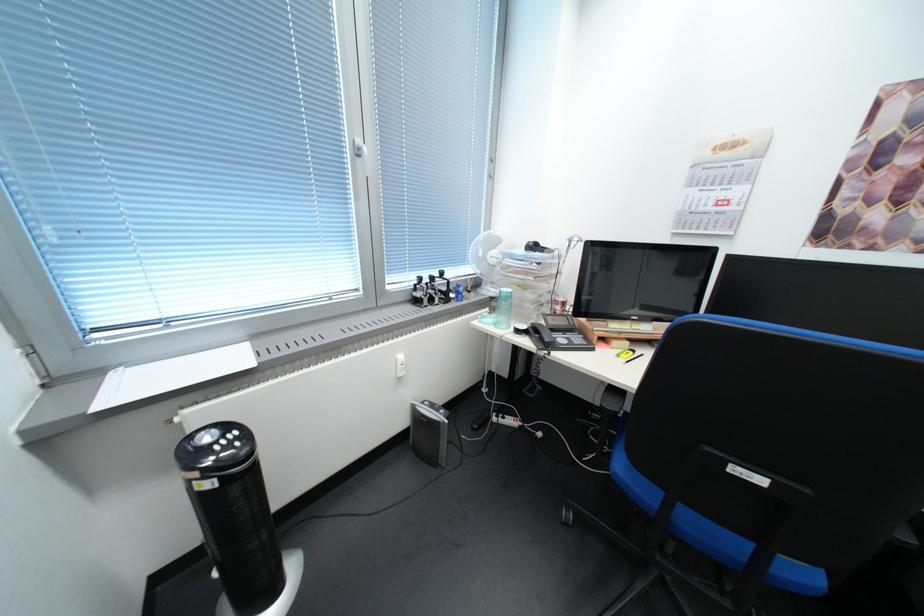
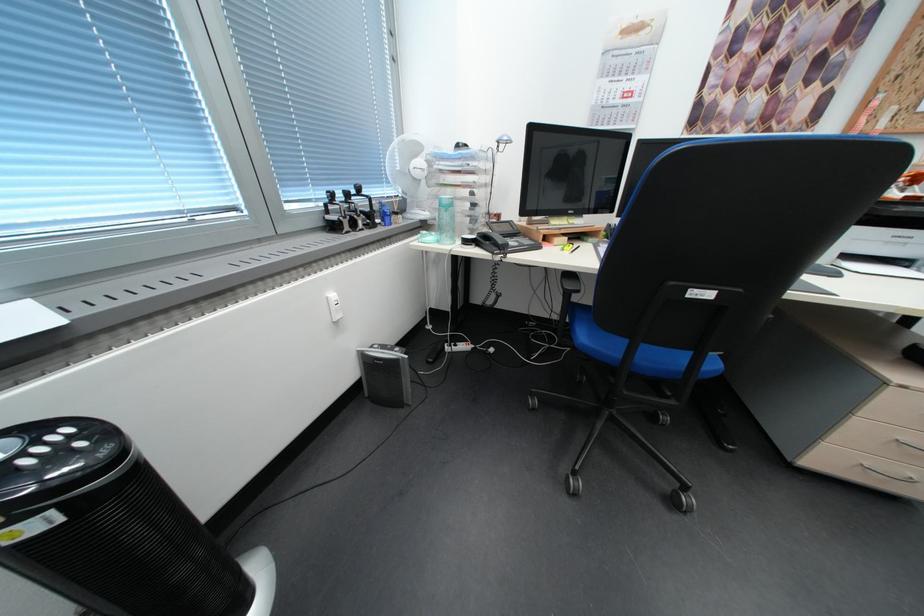
In the second image, find the point that corresponds to the point at 551,350 in the first image.

(505, 254)